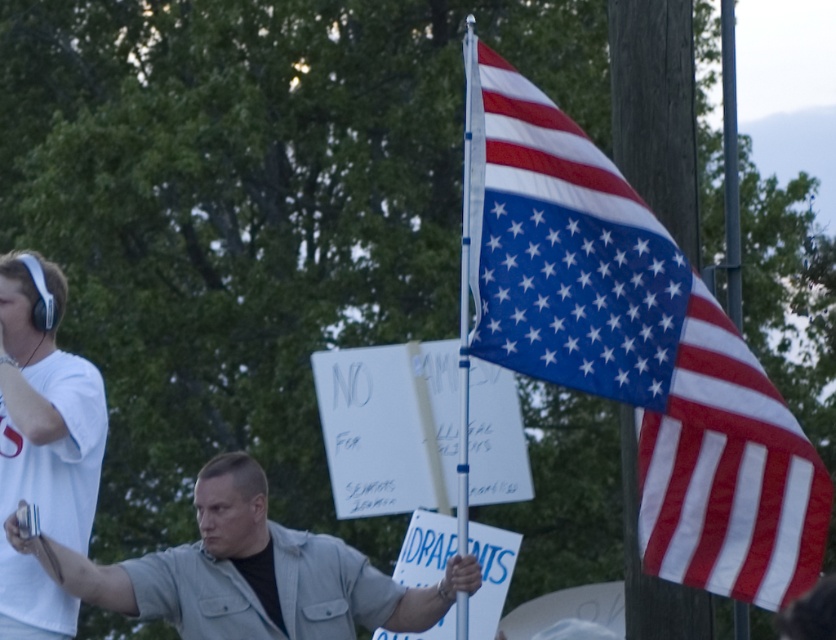
Question: Which of the following is the farthest from the observer?

Choices:
 (A) (72, 433)
 (B) (146, 564)
 (C) (664, 358)

Answer: (B)

Question: Where is polyester american flag at right located in relation to light gray denim jacket at center in the image?

Choices:
 (A) left
 (B) right

Answer: (B)

Question: Can you confirm if polyester american flag at right is positioned to the right of white matte headphones at upper left?

Choices:
 (A) no
 (B) yes

Answer: (B)

Question: Which of the following is the closest to the observer?

Choices:
 (A) light gray denim jacket at center
 (B) white matte headphones at upper left

Answer: (A)

Question: Considering the real-world distances, which object is closest to the white matte headphones at upper left?

Choices:
 (A) light gray denim jacket at center
 (B) polyester american flag at right

Answer: (A)

Question: Can you confirm if polyester american flag at right is smaller than light gray denim jacket at center?

Choices:
 (A) no
 (B) yes

Answer: (A)